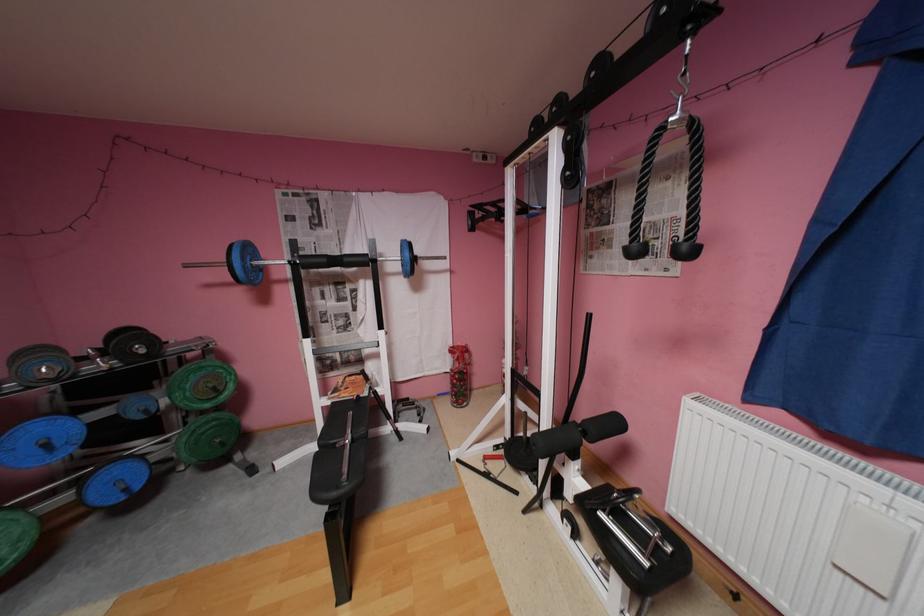
Locate an element on the screen. Image resolution: width=924 pixels, height=616 pixels. black vertical handle is located at coordinates (690, 209).